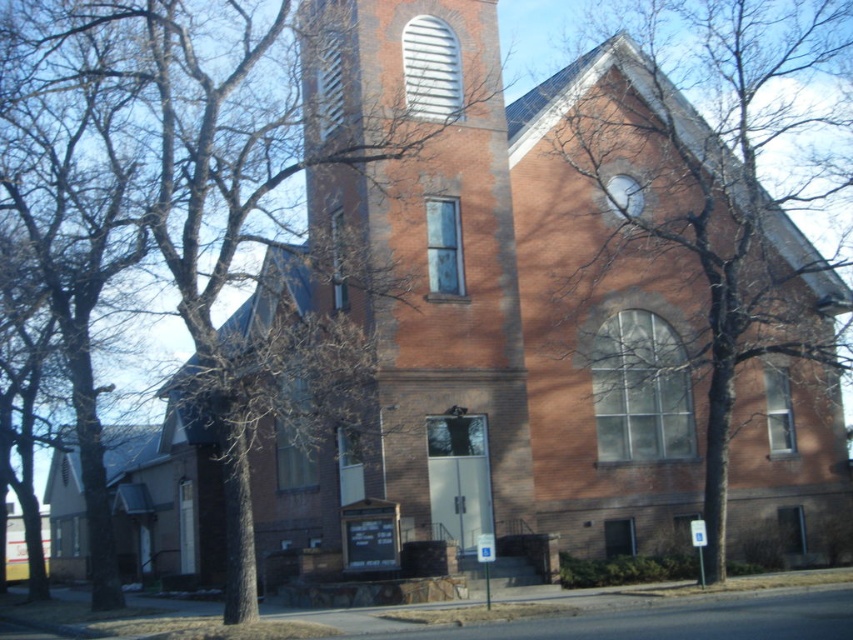
Question: Which object is farther from the camera taking this photo?

Choices:
 (A) brown bark tree at upper left
 (B) brown bark tree at right

Answer: (B)

Question: Is brown bark tree at upper left to the right of brown bark tree at right from the viewer's perspective?

Choices:
 (A) yes
 (B) no

Answer: (B)

Question: Can you confirm if brown bark tree at upper left is positioned to the right of brown bark tree at right?

Choices:
 (A) no
 (B) yes

Answer: (A)

Question: Which point is closer to the camera?

Choices:
 (A) brown bark tree at upper left
 (B) brown bark tree at right

Answer: (A)

Question: Is brown bark tree at upper left thinner than brown bark tree at right?

Choices:
 (A) yes
 (B) no

Answer: (A)